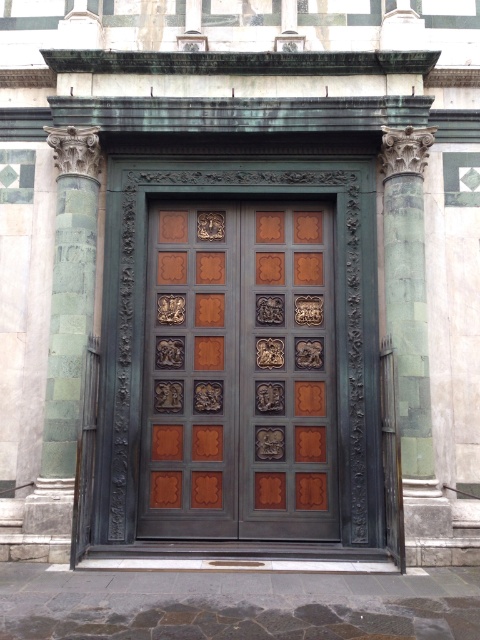
Who is lower down, green marble column at left or green marble column at right?

Positioned lower is green marble column at right.

You are a GUI agent. You are given a task and a screenshot of the screen. Output one action in this format:
    pyautogui.click(x=<x>, y=<y>)
    Task: Click on the green marble column at left
    
    Given the screenshot: What is the action you would take?
    pyautogui.click(x=70, y=291)

Is polished bronze door at center thinner than green marble column at left?

No.

Between point (250, 236) and point (54, 380), which one is positioned in front?

Positioned in front is point (54, 380).

Find the location of `polished bronze door at center`. polished bronze door at center is located at coordinates (239, 372).

Is polished bronze door at center shorter than green marble column at right?

Yes.

Is point (323, 493) positioned after point (406, 237)?

Yes, point (323, 493) is farther from viewer.

Where is `polished bronze door at center`? Image resolution: width=480 pixels, height=640 pixels. polished bronze door at center is located at coordinates (239, 372).